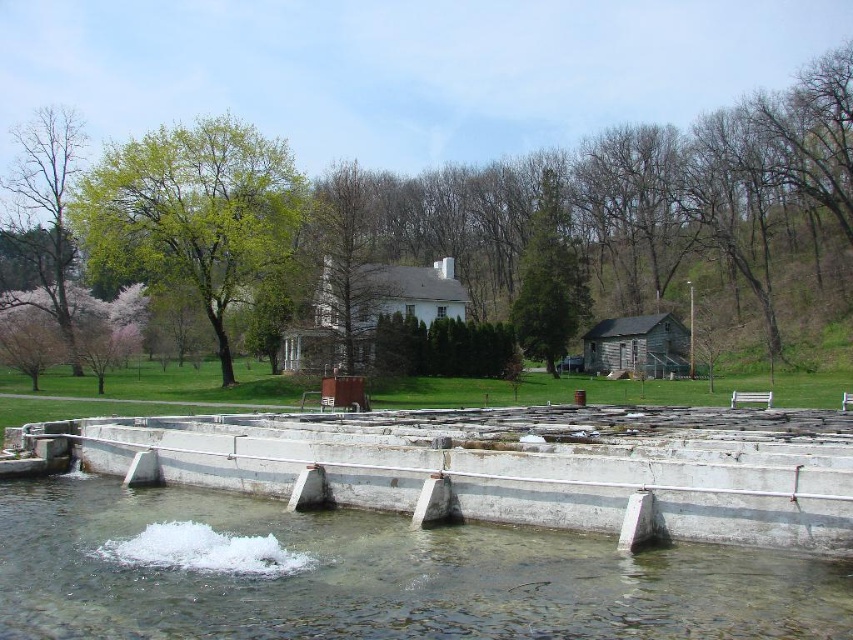
Question: Is clear concrete water at center closer to the viewer compared to white concrete dam at lower center?

Choices:
 (A) yes
 (B) no

Answer: (A)

Question: Which object is closer to the camera taking this photo?

Choices:
 (A) white concrete dam at lower center
 (B) clear concrete water at center

Answer: (B)

Question: Can you confirm if clear concrete water at center is smaller than white concrete dam at lower center?

Choices:
 (A) no
 (B) yes

Answer: (B)

Question: Which point is closer to the camera taking this photo?

Choices:
 (A) (456, 618)
 (B) (782, 515)

Answer: (A)

Question: Is the position of clear concrete water at center more distant than that of white concrete dam at lower center?

Choices:
 (A) no
 (B) yes

Answer: (A)